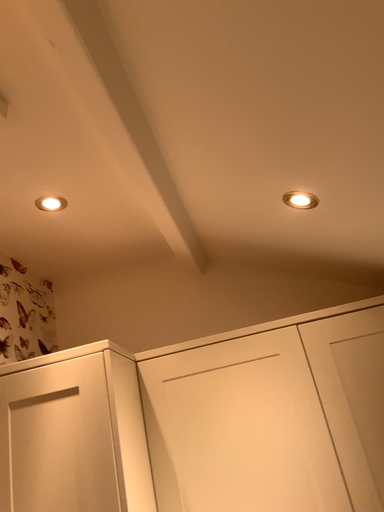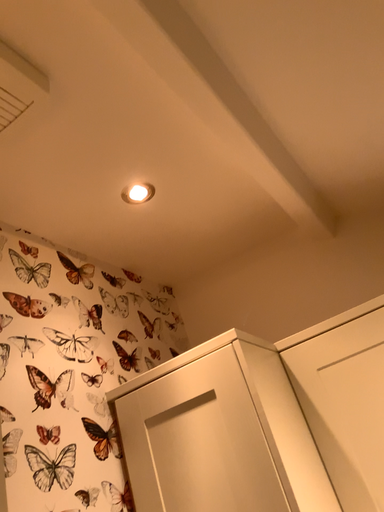
Question: How did the camera likely rotate when shooting the video?

Choices:
 (A) rotated left
 (B) rotated right

Answer: (A)